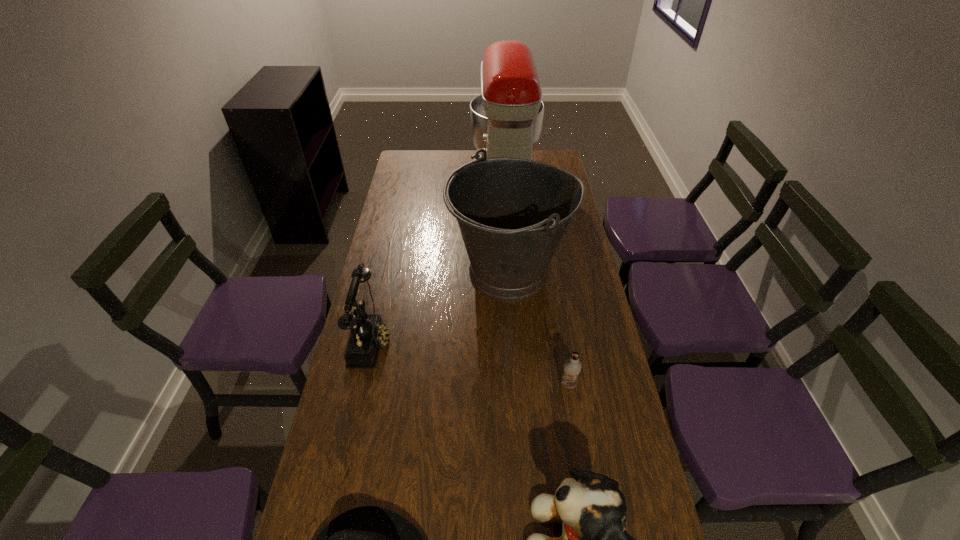
In the image, there is a desktop. What are the coordinates of `vacant space at the right edge` in the screenshot? It's located at (565, 238).

In order to click on vacant space at the far right corner in this screenshot , I will do `click(540, 157)`.

Locate an element on the screen. The width and height of the screenshot is (960, 540). vacant space that is in between the telephone and the fifth shortest object is located at coordinates [x=441, y=307].

At what (x,y) coordinates should I click in order to perform the action: click on vacant area that lies between the telephone and the third nearest object. Please return your answer as a coordinate pair (x, y). Looking at the image, I should click on point(469,362).

The image size is (960, 540). Find the location of `free space between the telephone and the bucket`. free space between the telephone and the bucket is located at coordinates (441, 307).

The image size is (960, 540). In order to click on vacant space that is in between the fifth tallest object and the bucket in this screenshot , I will do `click(540, 329)`.

Identify which object is the second closest to the farthest object. Please provide its 2D coordinates. Your answer should be formatted as a tuple, i.e. [(x, y)], where the tuple contains the x and y coordinates of a point satisfying the conditions above.

[(368, 333)]

Find the location of a particular element. The height and width of the screenshot is (540, 960). object that stands as the fourth closest to the third nearest object is located at coordinates pos(368,333).

Where is `free location that satisfies the following two spatial constraints: 1. on the front side of the second tallest object; 2. on the dial of the telephone`? free location that satisfies the following two spatial constraints: 1. on the front side of the second tallest object; 2. on the dial of the telephone is located at coordinates (515, 339).